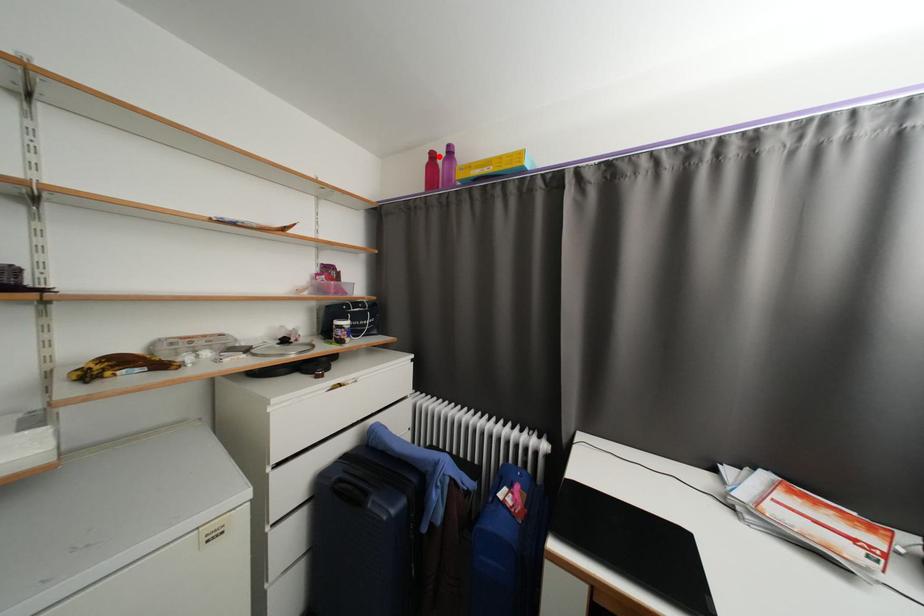
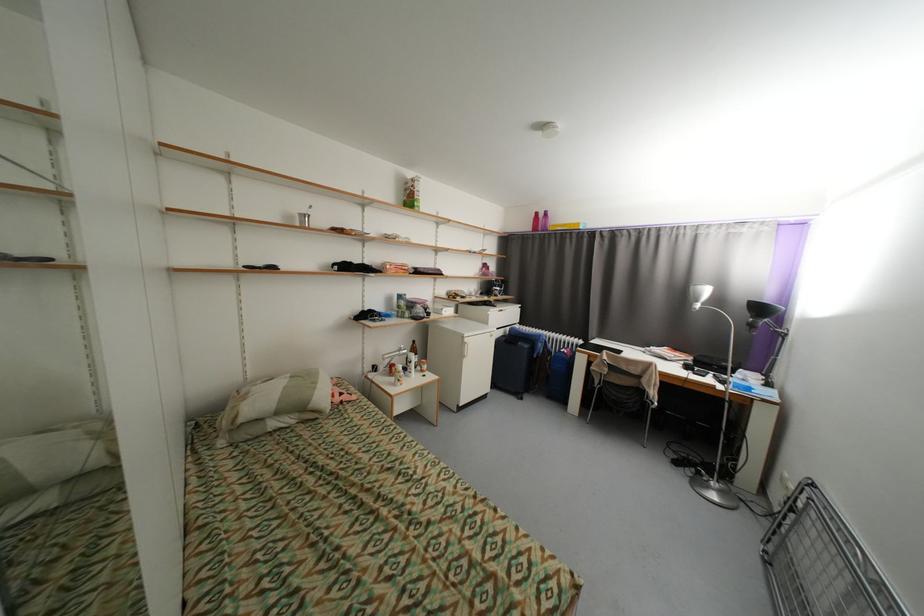
Find the pixel in the second image that matches the highlighted location in the first image.

(542, 215)